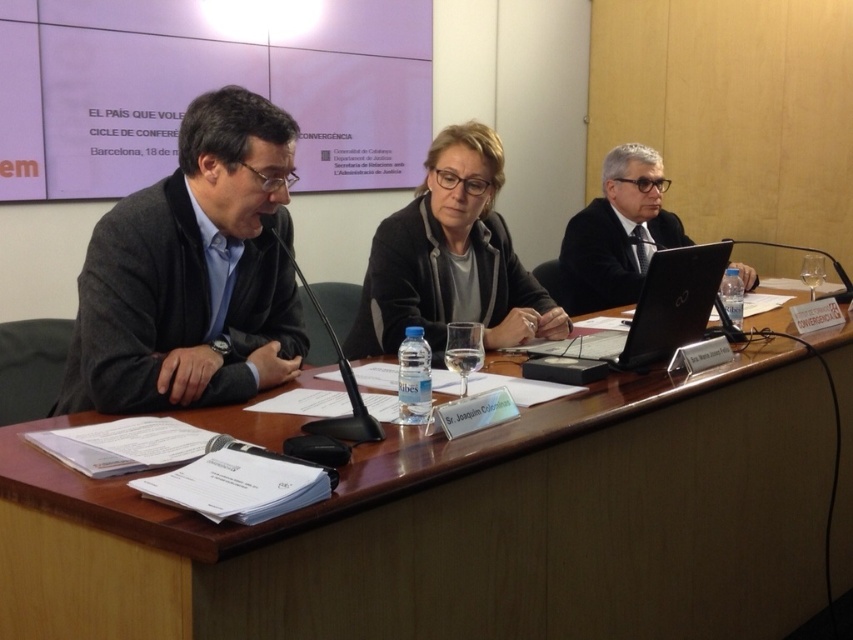
Question: Which point is closer to the camera?

Choices:
 (A) matte black jacket at center
 (B) black suit at center
 (C) matte black suit at left
 (D) wooden at left

Answer: (D)

Question: Which object appears farthest from the camera in this image?

Choices:
 (A) wooden at left
 (B) black suit at center
 (C) matte black suit at left
 (D) black plastic laptop at center

Answer: (B)

Question: Does matte black jacket at center appear on the right side of black suit at center?

Choices:
 (A) no
 (B) yes

Answer: (A)

Question: Is matte black jacket at center positioned at the back of black plastic laptop at center?

Choices:
 (A) no
 (B) yes

Answer: (B)

Question: Can you confirm if matte black suit at left is wider than matte black jacket at center?

Choices:
 (A) yes
 (B) no

Answer: (B)

Question: Which of the following is the closest to the observer?

Choices:
 (A) (280, 257)
 (B) (398, 266)
 (C) (413, 545)
 (D) (663, 260)

Answer: (C)